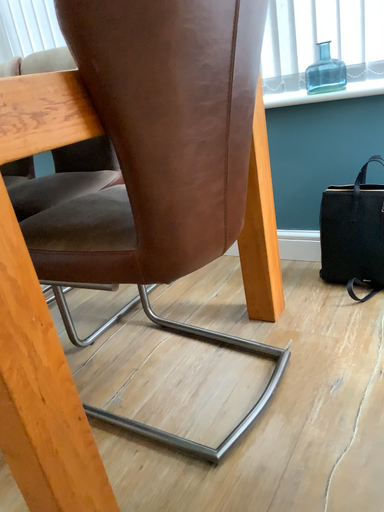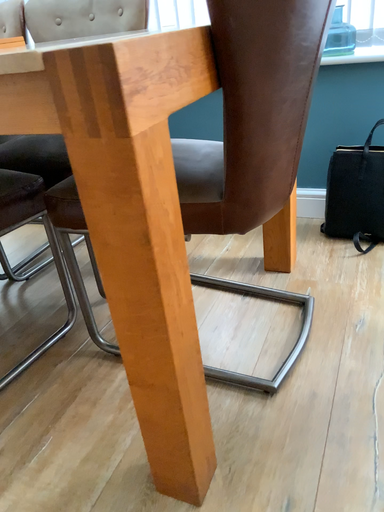
Question: Which way did the camera rotate in the video?

Choices:
 (A) rotated right
 (B) rotated left

Answer: (A)